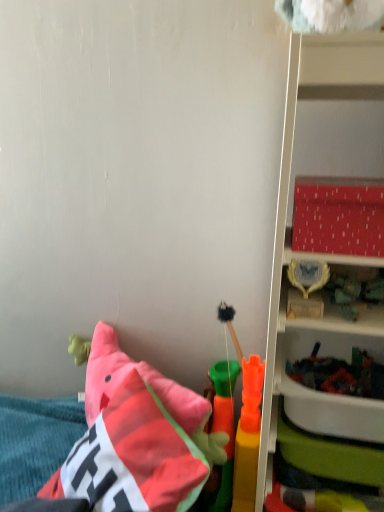
Question: In the image, is matte red plastic shelf at right positioned in front of or behind rubber carrot at center, acting as the second toy starting from the front?

Choices:
 (A) behind
 (B) front

Answer: (B)

Question: In terms of size, does matte red plastic shelf at right appear bigger or smaller than rubber carrot at center, which ranks as the second toy in back-to-front order?

Choices:
 (A) small
 (B) big

Answer: (B)

Question: Based on their relative distances, which object is farther from the soft plush pillow at lower left?

Choices:
 (A) matte red plastic shelf at right
 (B) rubber carrot at center, which ranks as the second toy in back-to-front order
 (C) soft fuzzy brush at center, the 3th toy from the front
 (D) smooth plastic toy at lower right, placed as the 3th toy when sorted from back to front

Answer: (A)

Question: Considering the real-world distances, which object is farthest from the matte red plastic shelf at right?

Choices:
 (A) rubber carrot at center, which ranks as the second toy in back-to-front order
 (B) soft plush pillow at lower left
 (C) soft fuzzy brush at center, the 3th toy from the front
 (D) smooth plastic toy at lower right, which ranks as the first toy in front-to-back order

Answer: (C)